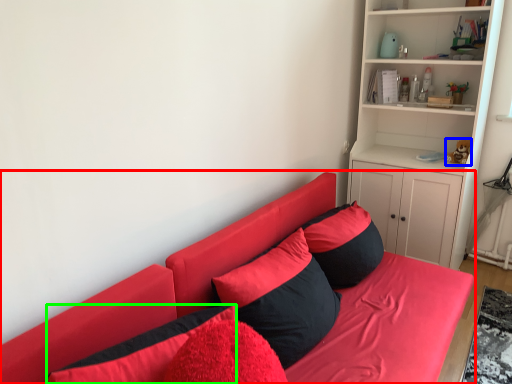
Question: Considering the real-world distances, which object is closest to studio couch (highlighted by a red box)? toy (highlighted by a blue box) or pillow (highlighted by a green box).

Choices:
 (A) toy
 (B) pillow

Answer: (B)